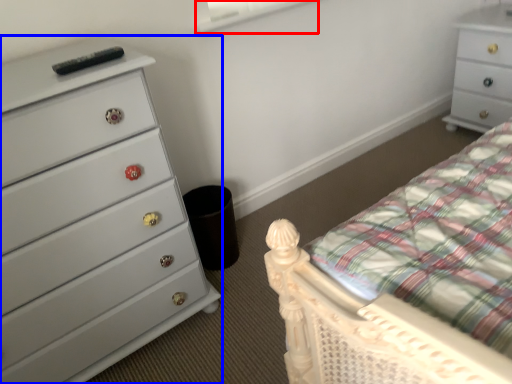
Question: Which of the following is the closest to the observer, window screen (highlighted by a red box) or chest of drawers (highlighted by a blue box)?

Choices:
 (A) window screen
 (B) chest of drawers

Answer: (B)